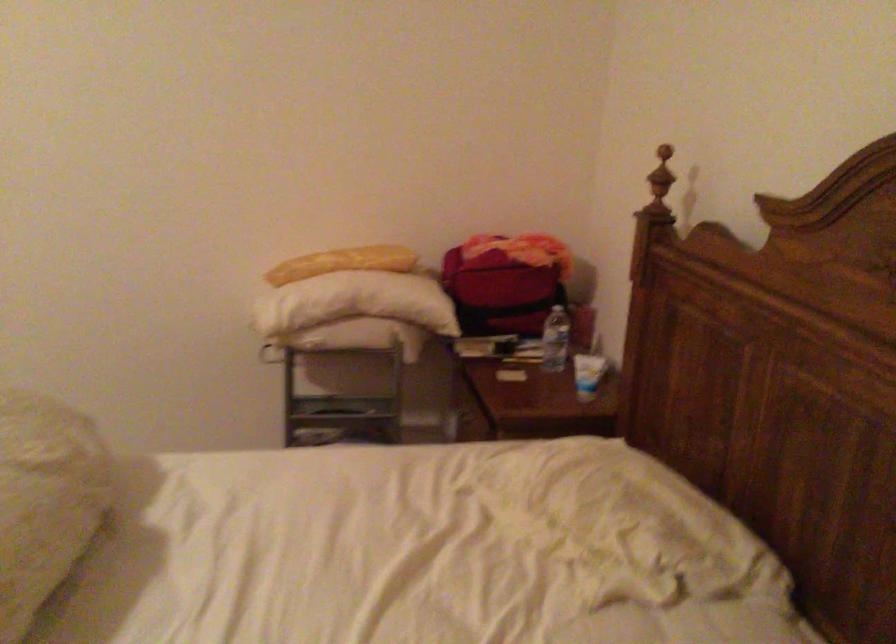
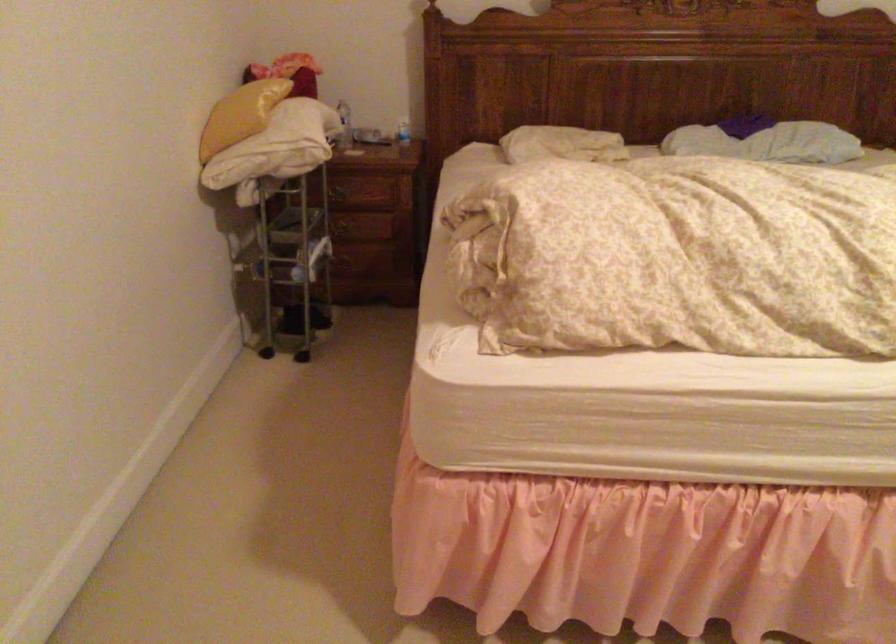
Question: I am providing you with two images of the same scene from different viewpoints. Please identify which objects are invisible in image2.

Choices:
 (A) red bag
 (B) red club headcover
 (C) plastic water bottle
 (D) white pillow

Answer: (A)